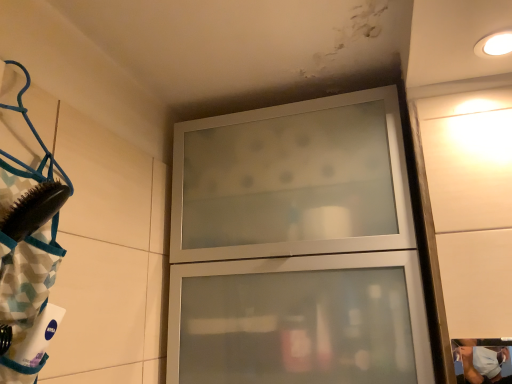
Measure the distance between satin glass cabinet at upper center and camera.

82.90 centimeters.

Identify the location of satin glass cabinet at upper center. (296, 247).

Describe the element at coordinates (296, 247) in the screenshot. I see `satin glass cabinet at upper center` at that location.

The height and width of the screenshot is (384, 512). I want to click on satin glass cabinet at upper center, so click(x=296, y=247).